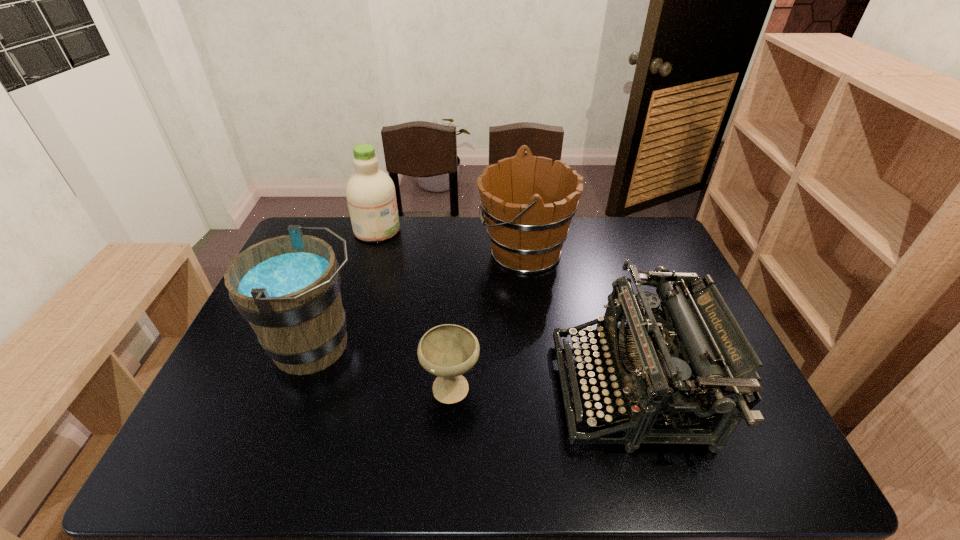
The image size is (960, 540). I want to click on free point at the far edge, so click(x=589, y=241).

At what (x,y) coordinates should I click in order to perform the action: click on free location at the near edge. Please return your answer as a coordinate pair (x, y). Image resolution: width=960 pixels, height=540 pixels. Looking at the image, I should click on (643, 477).

In the image, there is a desktop. Where is `vacant space at the left edge`? The height and width of the screenshot is (540, 960). vacant space at the left edge is located at coordinates (235, 347).

Find the location of `vacant space at the far left corner of the desktop`. vacant space at the far left corner of the desktop is located at coordinates (337, 227).

The width and height of the screenshot is (960, 540). In order to click on free region at the far right corner in this screenshot , I will do coord(661,230).

Where is `free space between the nearer wine bucket and the shortest object`? The width and height of the screenshot is (960, 540). free space between the nearer wine bucket and the shortest object is located at coordinates (384, 366).

Locate an element on the screen. This screenshot has width=960, height=540. unoccupied area between the right wine bucket and the cleansing agent is located at coordinates (450, 240).

This screenshot has width=960, height=540. Identify the location of empty space between the second shortest object and the cleansing agent. (503, 309).

This screenshot has height=540, width=960. I want to click on free space between the right wine bucket and the typewriter, so click(x=577, y=320).

Image resolution: width=960 pixels, height=540 pixels. Find the location of `free spot between the left wine bucket and the cleansing agent`. free spot between the left wine bucket and the cleansing agent is located at coordinates (347, 288).